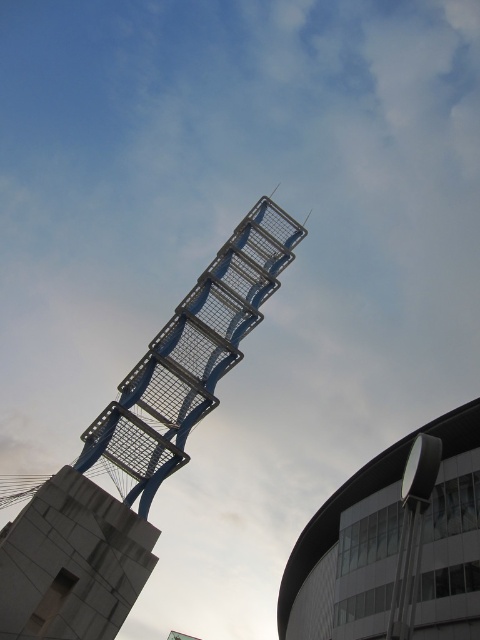
Question: Is metallic grid tower at center to the left of metallic silver tower at upper center from the viewer's perspective?

Choices:
 (A) no
 (B) yes

Answer: (B)

Question: Which of the following is the closest to the observer?

Choices:
 (A) (175, 417)
 (B) (372, 461)

Answer: (A)

Question: Can you confirm if metallic grid tower at center is bigger than metallic silver tower at upper center?

Choices:
 (A) no
 (B) yes

Answer: (B)

Question: Which of the following is the farthest from the observer?

Choices:
 (A) metallic grid tower at center
 (B) metallic silver tower at upper center

Answer: (B)

Question: Which point is farther from the camera taking this photo?

Choices:
 (A) (156, 456)
 (B) (330, 506)

Answer: (B)

Question: Can you confirm if metallic grid tower at center is positioned below metallic silver tower at upper center?

Choices:
 (A) yes
 (B) no

Answer: (B)